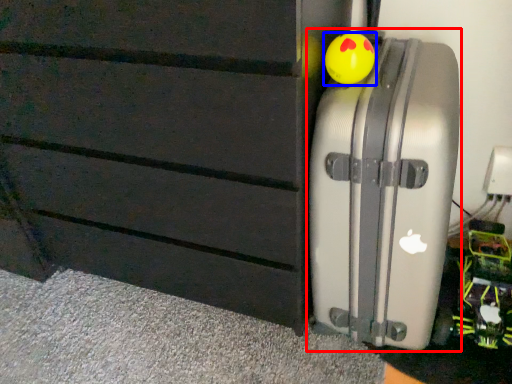
Question: Which of the following is the farthest to the observer, suitcase (highlighted by a red box) or toy (highlighted by a blue box)?

Choices:
 (A) suitcase
 (B) toy

Answer: (B)